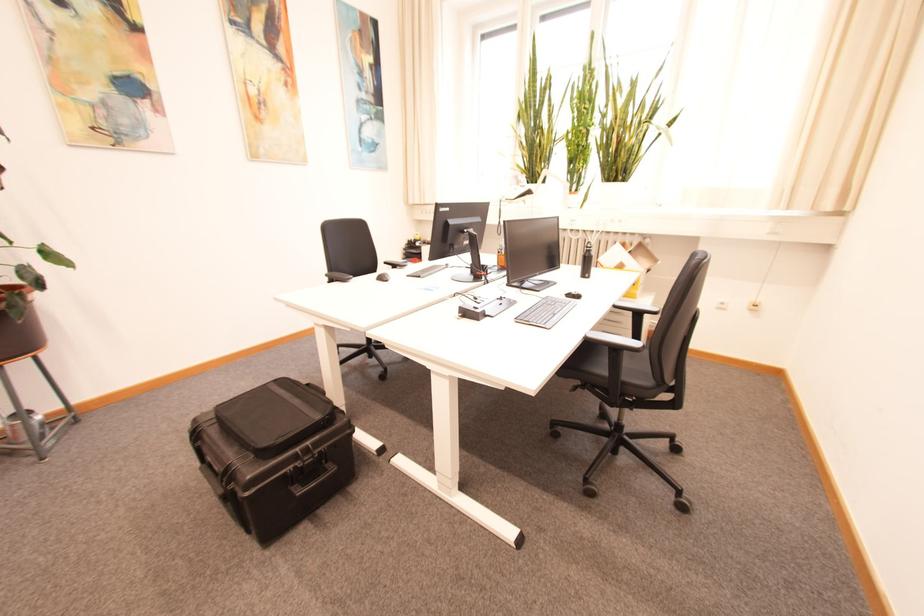
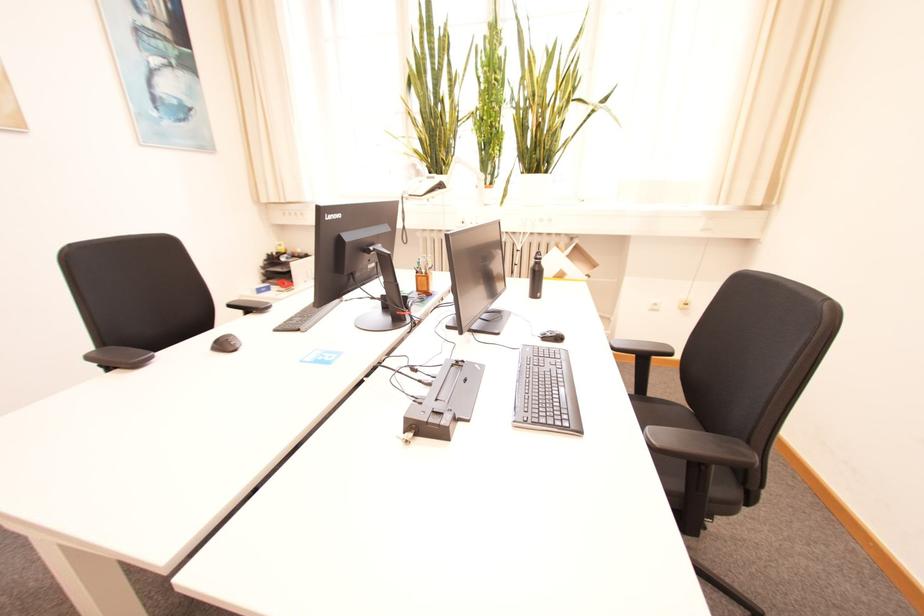
Question: The camera is either moving clockwise (left) or counter-clockwise (right) around the object. The first image is from the beginning of the video and the second image is from the end. Is the camera moving left or right when shooting the video?

Choices:
 (A) Left
 (B) Right

Answer: (A)